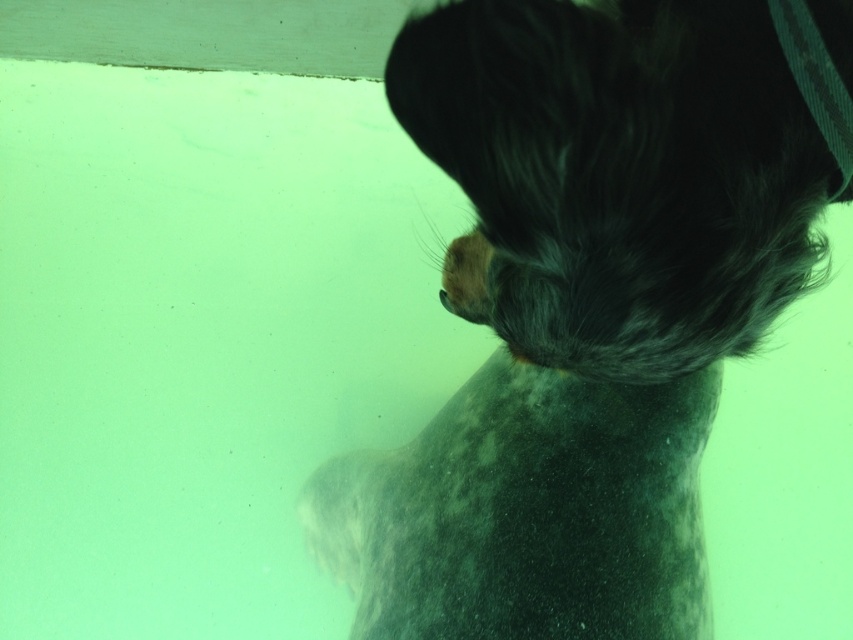
You are a photographer trying to capture a clear shot of the fluffy gray dog at upper right. The camera you are using has a maximum focus range of 90 centimeters. Can you focus on the dog with your current settings?

The distance between the photographer and the fluffy gray dog at upper right is 92.26 centimeters, which exceeds the camera maximum focus range of 90 centimeters. Therefore, the photographer cannot focus on the dog with the current settings.

You are standing at the edge of a pool and see the fluffy gray dog at upper right swimming towards you. If the pool is 36 inches deep, will the dog be able to touch the bottom with its paws?

The fluffy gray dog at upper right and viewer are 36.32 inches apart. Since the pool is 36 inches deep, the dog can just barely touch the bottom with its paws as the distance between them is slightly more than the pool depth.